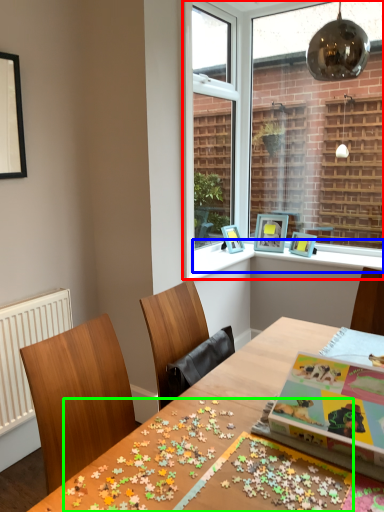
Question: Estimate the real-world distances between objects in this image. Which object is farther from window (highlighted by a red box), window sill (highlighted by a blue box) or board game (highlighted by a green box)?

Choices:
 (A) window sill
 (B) board game

Answer: (B)